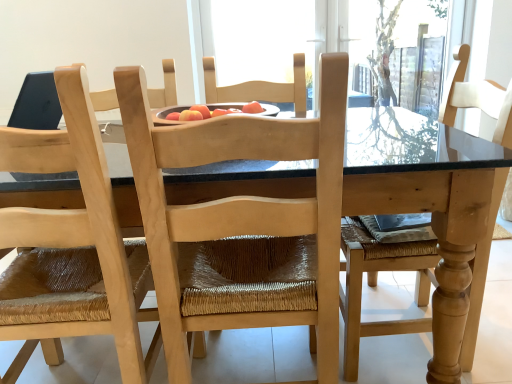
Question: In terms of size, does natural wood table at center appear bigger or smaller than natural wood chair at center, the second chair in the right-to-left sequence?

Choices:
 (A) small
 (B) big

Answer: (B)

Question: In the image, is natural wood table at center positioned in front of or behind natural wood chair at center, the second chair in the right-to-left sequence?

Choices:
 (A) front
 (B) behind

Answer: (B)

Question: Based on their relative distances, which object is farther from the natural wood chair at center, the first chair when ordered from right to left?

Choices:
 (A) natural wood table at center
 (B) natural wood chair at center, which is the 1th chair in left-to-right order

Answer: (A)

Question: Estimate the real-world distances between objects in this image. Which object is closer to the natural wood chair at center, the second chair in the right-to-left sequence?

Choices:
 (A) natural wood table at center
 (B) natural wood chair at center, which appears as the second chair when viewed from the left

Answer: (B)